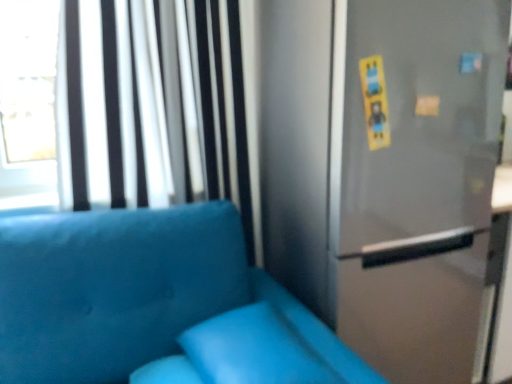
Locate an element on the screen. white/textured curtain at upper left is located at coordinates (151, 104).

At what (x,y) coordinates should I click in order to perform the action: click on satin silver fridge at right. Please return your answer as a coordinate pair (x, y). Looking at the image, I should click on (384, 171).

What is the approximate height of satin silver screen door at upper right?

It is 41.07 centimeters.

Image resolution: width=512 pixels, height=384 pixels. Identify the location of suede blue couch at lower left. (154, 305).

Is white/textured curtain at upper left wider than satin silver screen door at upper right?

Yes, white/textured curtain at upper left is wider than satin silver screen door at upper right.

Is white/textured curtain at upper left not inside satin silver screen door at upper right?

Indeed, white/textured curtain at upper left is completely outside satin silver screen door at upper right.

Which object is closer to the camera taking this photo, white/textured curtain at upper left or satin silver screen door at upper right?

satin silver screen door at upper right is in front.

From the image's perspective, which is above, white/textured curtain at upper left or satin silver screen door at upper right?

satin silver screen door at upper right, from the image's perspective.

Is suede blue couch at lower left aimed at matte blue pillow at lower center?

Yes, suede blue couch at lower left is oriented towards matte blue pillow at lower center.

Measure the distance from suede blue couch at lower left to matte blue pillow at lower center.

suede blue couch at lower left and matte blue pillow at lower center are 4.72 inches apart.

Is suede blue couch at lower left at the left side of matte blue pillow at lower center?

Yes, suede blue couch at lower left is to the left of matte blue pillow at lower center.

From the image's perspective, is suede blue couch at lower left located above or below matte blue pillow at lower center?

From the image's perspective, suede blue couch at lower left appears below matte blue pillow at lower center.

Is point (65, 332) farther from viewer compared to point (271, 99)?

No, (65, 332) is closer to viewer.

Is suede blue couch at lower left positioned beyond the bounds of satin silver fridge at right?

suede blue couch at lower left is positioned outside satin silver fridge at right.

From a real-world perspective, is suede blue couch at lower left over satin silver fridge at right?

No, from a real-world perspective, suede blue couch at lower left is not over satin silver fridge at right

Does suede blue couch at lower left appear on the right side of satin silver screen door at upper right?

In fact, suede blue couch at lower left is to the left of satin silver screen door at upper right.

Considering the sizes of objects suede blue couch at lower left and satin silver screen door at upper right in the image provided, who is shorter, suede blue couch at lower left or satin silver screen door at upper right?

satin silver screen door at upper right is shorter.

Which is nearer, (x=95, y=206) or (x=145, y=212)?

Clearly, point (x=95, y=206) is more distant from the camera than point (x=145, y=212).

From the image's perspective, which one is positioned lower, white/textured curtain at upper left or suede blue couch at lower left?

suede blue couch at lower left appears lower in the image.

From a real-world perspective, is white/textured curtain at upper left physically below suede blue couch at lower left?

No, from a real-world perspective, white/textured curtain at upper left is not beneath suede blue couch at lower left.

Is white/textured curtain at upper left positioned with its back to suede blue couch at lower left?

white/textured curtain at upper left does not have its back to suede blue couch at lower left.

Who is bigger, satin silver screen door at upper right or suede blue couch at lower left?

suede blue couch at lower left.

What's the angular difference between satin silver screen door at upper right and suede blue couch at lower left's facing directions?

The facing directions of satin silver screen door at upper right and suede blue couch at lower left are 1.86 degrees apart.

Consider the image. Is satin silver screen door at upper right aimed at suede blue couch at lower left?

No, satin silver screen door at upper right does not turn towards suede blue couch at lower left.

From the image's perspective, which one is positioned lower, satin silver screen door at upper right or suede blue couch at lower left?

From the image's view, suede blue couch at lower left is below.

From the image's perspective, is satin silver screen door at upper right under satin silver fridge at right?

No, from the image's perspective, satin silver screen door at upper right is not below satin silver fridge at right.

From a real-world perspective, who is located higher, satin silver screen door at upper right or satin silver fridge at right?

satin silver screen door at upper right, from a real-world perspective.

Which is closer, [448,58] or [395,94]?

Point [448,58] is positioned farther from the camera compared to point [395,94].

Consider the image. Is satin silver screen door at upper right bigger than satin silver fridge at right?

Actually, satin silver screen door at upper right might be smaller than satin silver fridge at right.

Locate an element on the screen. screen door that is in front of the white/textured curtain at upper left is located at coordinates (414, 119).

Where is `pillow above the suede blue couch at lower left (from the image's perspective)`? This screenshot has height=384, width=512. pillow above the suede blue couch at lower left (from the image's perspective) is located at coordinates (253, 350).

Consider the image. From the image, which object appears to be farther from matte blue pillow at lower center, satin silver fridge at right or white/textured curtain at upper left?

white/textured curtain at upper left is positioned further to the anchor matte blue pillow at lower center.

Looking at the image, which one is located closer to white/textured curtain at upper left, suede blue couch at lower left or satin silver screen door at upper right?

suede blue couch at lower left.

Based on their spatial positions, is matte blue pillow at lower center or satin silver fridge at right further from satin silver screen door at upper right?

Based on the image, matte blue pillow at lower center appears to be further to satin silver screen door at upper right.

When comparing their distances from satin silver screen door at upper right, does suede blue couch at lower left or satin silver fridge at right seem closer?

satin silver fridge at right.

Based on their spatial positions, is matte blue pillow at lower center or satin silver fridge at right further from white/textured curtain at upper left?

matte blue pillow at lower center lies further to white/textured curtain at upper left than the other object.

Considering their positions, is satin silver fridge at right positioned further to white/textured curtain at upper left than suede blue couch at lower left?

satin silver fridge at right is further to white/textured curtain at upper left.

Estimate the real-world distances between objects in this image. Which object is further from satin silver screen door at upper right, white/textured curtain at upper left or satin silver fridge at right?

The object further to satin silver screen door at upper right is white/textured curtain at upper left.

Estimate the real-world distances between objects in this image. Which object is further from matte blue pillow at lower center, satin silver screen door at upper right or satin silver fridge at right?

satin silver screen door at upper right is further to matte blue pillow at lower center.

Where is `furniture between white/textured curtain at upper left and satin silver screen door at upper right`? The height and width of the screenshot is (384, 512). furniture between white/textured curtain at upper left and satin silver screen door at upper right is located at coordinates (154, 305).

I want to click on fridge between white/textured curtain at upper left and satin silver screen door at upper right in the horizontal direction, so click(384, 171).

The height and width of the screenshot is (384, 512). Find the location of `pillow between suede blue couch at lower left and white/textured curtain at upper left from front to back`. pillow between suede blue couch at lower left and white/textured curtain at upper left from front to back is located at coordinates (253, 350).

Where is `pillow between white/textured curtain at upper left and satin silver screen door at upper right`? pillow between white/textured curtain at upper left and satin silver screen door at upper right is located at coordinates (253, 350).